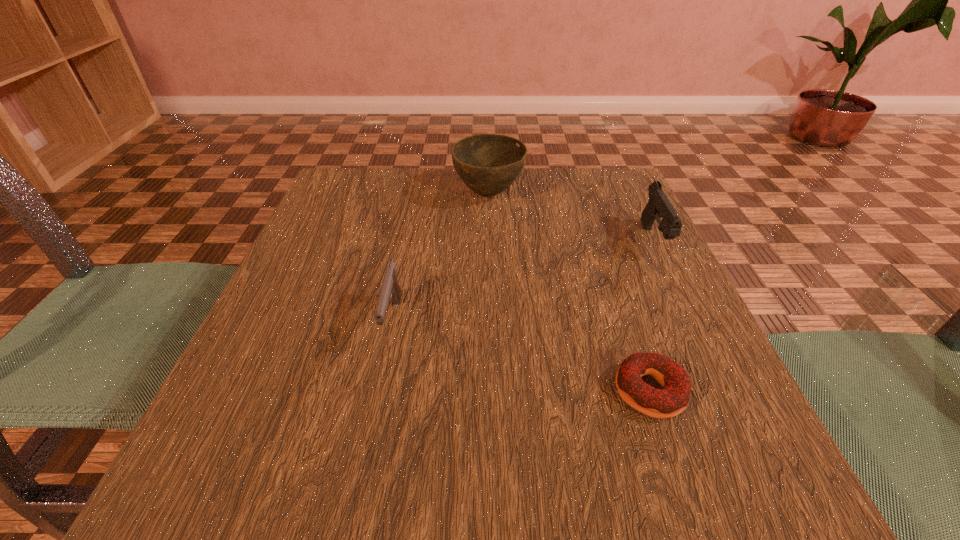
Find the location of a particular element. The height and width of the screenshot is (540, 960). the farthest object is located at coordinates (488, 164).

Where is `the second object from left to right`? the second object from left to right is located at coordinates (488, 164).

Locate an element on the screen. the farther pistol is located at coordinates (658, 205).

Locate an element on the screen. Image resolution: width=960 pixels, height=540 pixels. the second farthest object is located at coordinates (658, 205).

Find the location of `the left pistol`. the left pistol is located at coordinates (390, 290).

The width and height of the screenshot is (960, 540). I want to click on the third tallest object, so click(390, 290).

Find the location of a particular element. Image resolution: width=960 pixels, height=540 pixels. doughnut is located at coordinates (670, 401).

Image resolution: width=960 pixels, height=540 pixels. What are the coordinates of `the nearest object` in the screenshot? It's located at (670, 401).

What are the coordinates of `blank space located on the front of the farthest object` in the screenshot? It's located at (492, 335).

Find the location of `vacant area situated at the barrel of the rightmost object`. vacant area situated at the barrel of the rightmost object is located at coordinates (704, 342).